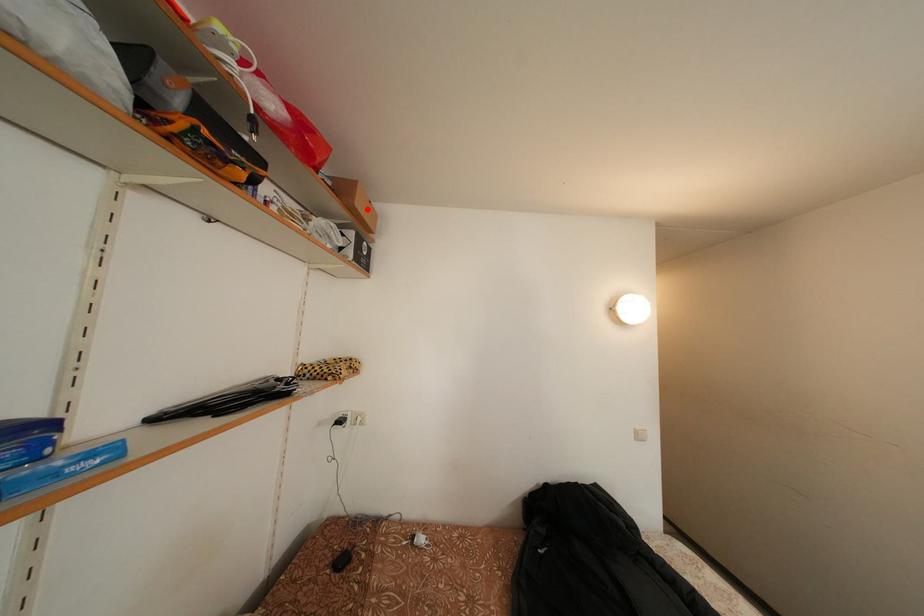
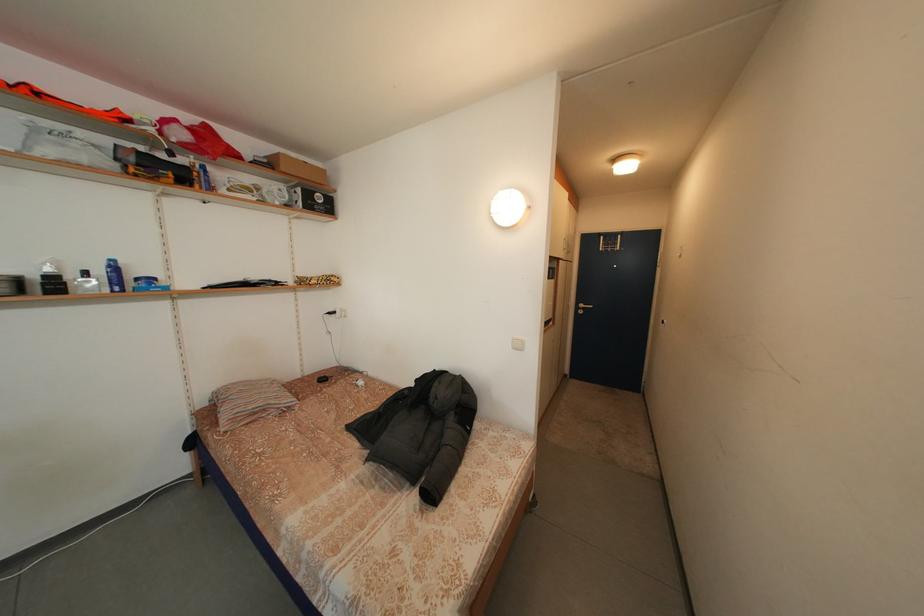
Where in the second image is the point corresponding to the highlighted location from the first image?

(292, 175)